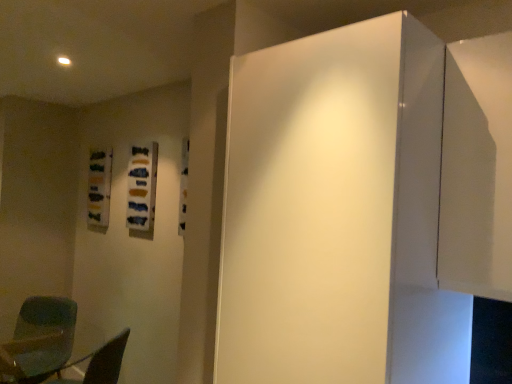
Describe the element at coordinates (310, 209) in the screenshot. I see `white glossy door at center` at that location.

The width and height of the screenshot is (512, 384). What do you see at coordinates (39, 340) in the screenshot?
I see `matte green chair at lower left` at bounding box center [39, 340].

Where is `white glossy door at center`? white glossy door at center is located at coordinates (x=310, y=209).

From a real-world perspective, is matte green chair at lower left beneath white glossy door at center?

Indeed, from a real-world perspective, matte green chair at lower left is positioned beneath white glossy door at center.

From the picture: Considering the relative sizes of matte green chair at lower left and white glossy door at center in the image provided, is matte green chair at lower left taller than white glossy door at center?

No, matte green chair at lower left is not taller than white glossy door at center.

From the image's perspective, is matte green chair at lower left above or below white glossy door at center?

matte green chair at lower left is situated lower than white glossy door at center in the image.

Is matte green chair at lower left next to white glossy door at center?

No, matte green chair at lower left is not touching white glossy door at center.

Does transparent plastic chair at lower left have a smaller size compared to white glossy door at center?

Indeed, transparent plastic chair at lower left has a smaller size compared to white glossy door at center.

Could you tell me if transparent plastic chair at lower left is turned towards white glossy door at center?

No, transparent plastic chair at lower left is not oriented towards white glossy door at center.

Is transparent plastic chair at lower left not inside white glossy door at center?

Absolutely, transparent plastic chair at lower left is external to white glossy door at center.

Consider the image. Which object is further away from the camera, transparent plastic chair at lower left or white glossy door at center?

transparent plastic chair at lower left.

Is white glossy door at center placed right next to matte green chair at lower left?

white glossy door at center is not next to matte green chair at lower left, and they're not touching.

From a real-world perspective, who is located higher, white glossy door at center or matte green chair at lower left?

white glossy door at center.

Which is behind, white glossy door at center or matte green chair at lower left?

matte green chair at lower left is further away from the camera.

Is white glossy door at center oriented away from matte green chair at lower left?

No, white glossy door at center's orientation is not away from matte green chair at lower left.

Find the location of a particular element. The image size is (512, 384). chair on the left of transparent plastic chair at lower left is located at coordinates (39, 340).

Considering the sizes of objects matte green chair at lower left and transparent plastic chair at lower left in the image provided, who is smaller, matte green chair at lower left or transparent plastic chair at lower left?

transparent plastic chair at lower left.

From a real-world perspective, which is physically below, matte green chair at lower left or transparent plastic chair at lower left?

matte green chair at lower left, from a real-world perspective.

Is matte green chair at lower left far from transparent plastic chair at lower left?

That's not correct — matte green chair at lower left is a little close to transparent plastic chair at lower left.

Is white glossy door at center to the left of transparent plastic chair at lower left from the viewer's perspective?

No.

Considering the sizes of white glossy door at center and transparent plastic chair at lower left in the image, is white glossy door at center taller or shorter than transparent plastic chair at lower left?

Considering their sizes, white glossy door at center has more height than transparent plastic chair at lower left.

Is white glossy door at center positioned in front of transparent plastic chair at lower left?

That is True.

How far apart are transparent plastic chair at lower left and matte green chair at lower left?

transparent plastic chair at lower left is 27.63 inches from matte green chair at lower left.

Where is `chair located on the left of transparent plastic chair at lower left`? chair located on the left of transparent plastic chair at lower left is located at coordinates (39, 340).

Is point (121, 345) closer or farther from the camera than point (30, 311)?

Clearly, point (121, 345) is closer to the camera than point (30, 311).

Is transparent plastic chair at lower left next to matte green chair at lower left and touching it?

No, transparent plastic chair at lower left is not with matte green chair at lower left.

Where is `door on the right of matte green chair at lower left`? door on the right of matte green chair at lower left is located at coordinates (310, 209).

Where is `door that appears above the transparent plastic chair at lower left (from the image's perspective)`? Image resolution: width=512 pixels, height=384 pixels. door that appears above the transparent plastic chair at lower left (from the image's perspective) is located at coordinates (310, 209).

Which object lies nearer to the anchor point transparent plastic chair at lower left, white glossy door at center or matte green chair at lower left?

Among the two, matte green chair at lower left is located nearer to transparent plastic chair at lower left.

Looking at the image, which one is located further to white glossy door at center, transparent plastic chair at lower left or matte green chair at lower left?

matte green chair at lower left.

When comparing their distances from transparent plastic chair at lower left, does matte green chair at lower left or white glossy door at center seem closer?

Among the two, matte green chair at lower left is located nearer to transparent plastic chair at lower left.

Estimate the real-world distances between objects in this image. Which object is closer to matte green chair at lower left, white glossy door at center or transparent plastic chair at lower left?

transparent plastic chair at lower left is positioned closer to the anchor matte green chair at lower left.

Based on their spatial positions, is transparent plastic chair at lower left or white glossy door at center closer to matte green chair at lower left?

transparent plastic chair at lower left lies closer to matte green chair at lower left than the other object.

Looking at the image, which one is located closer to white glossy door at center, matte green chair at lower left or transparent plastic chair at lower left?

transparent plastic chair at lower left.

You are a GUI agent. You are given a task and a screenshot of the screen. Output one action in this format:
    pyautogui.click(x=<x>, y=<y>)
    Task: Click on the furniture between matte green chair at lower left and white glossy door at center
    This screenshot has width=512, height=384.
    Given the screenshot: What is the action you would take?
    pyautogui.click(x=76, y=364)